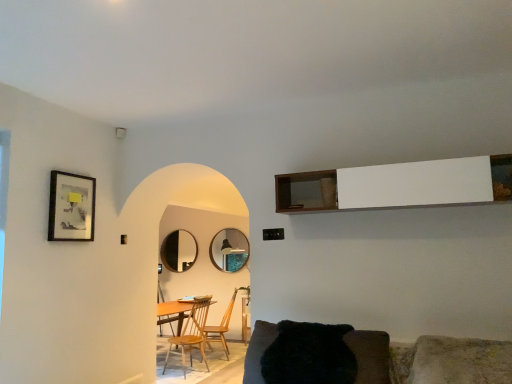
Question: In terms of size, does matte black picture frame at upper left appear bigger or smaller than matte silver mirror at center, which is the second mirror in left-to-right order?

Choices:
 (A) small
 (B) big

Answer: (A)

Question: From the image's perspective, relative to matte silver mirror at center, which is the second mirror in left-to-right order, is matte black picture frame at upper left above or below?

Choices:
 (A) below
 (B) above

Answer: (B)

Question: Which is nearer to the black furry chair at lower center, which is counted as the 1th chair, starting from the front?

Choices:
 (A) wooden at left, arranged as the 2th chair when viewed from the back
 (B) matte silver mirror at center, the 1th mirror positioned from the front
 (C) white wood cabinet at upper center
 (D) matte black mirror at center, which is the 2th mirror in right-to-left order
 (E) matte black picture frame at upper left

Answer: (C)

Question: Which object is positioned farthest from the wooden chair at center, acting as the second chair starting from the left?

Choices:
 (A) black furry chair at lower center, acting as the third chair starting from the back
 (B) matte black mirror at center, which is the 2th mirror in right-to-left order
 (C) matte black picture frame at upper left
 (D) matte silver mirror at center, the 1th mirror positioned from the front
 (E) wooden at left, arranged as the 2th chair when viewed from the back

Answer: (A)